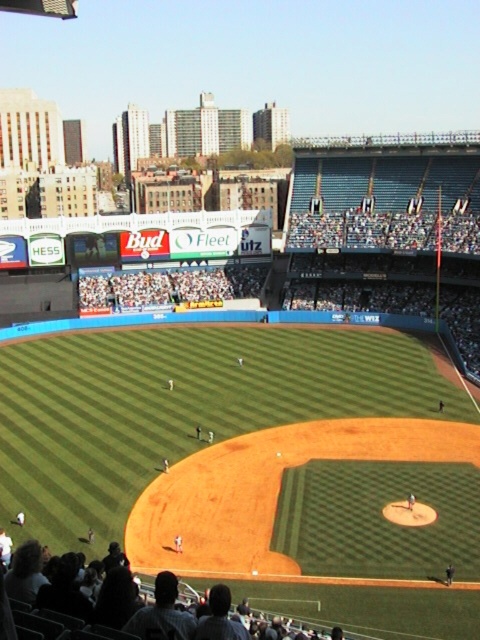
Can you confirm if green grass baseball field at center is positioned below dark gray fabric seats at lower center?

No.

Which is more to the left, green grass baseball field at center or dark gray fabric seats at lower center?

Positioned to the left is green grass baseball field at center.

Measure the distance between green grass baseball field at center and camera.

They are 146.16 feet apart.

I want to click on green grass baseball field at center, so click(240, 448).